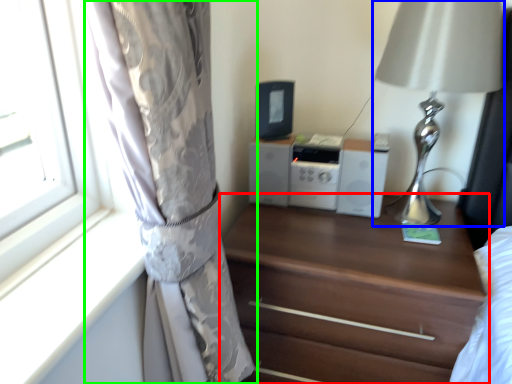
Question: Considering the real-world distances, which object is farthest from chest of drawers (highlighted by a red box)? table lamp (highlighted by a blue box) or curtain (highlighted by a green box)?

Choices:
 (A) table lamp
 (B) curtain

Answer: (B)